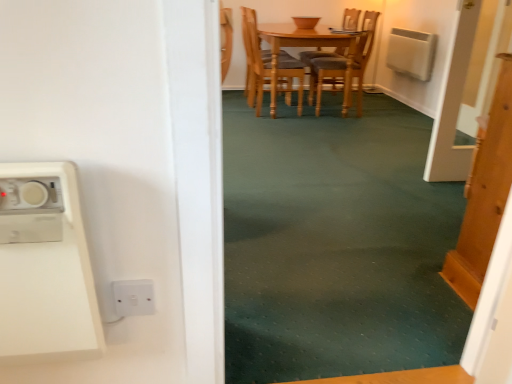
Question: Considering the relative sizes of wooden door at right and light brown wooden chair at center in the image provided, is wooden door at right shorter than light brown wooden chair at center?

Choices:
 (A) no
 (B) yes

Answer: (A)

Question: Is wooden door at right taller than light brown wooden chair at center?

Choices:
 (A) yes
 (B) no

Answer: (A)

Question: From a real-world perspective, is wooden door at right under light brown wooden chair at center?

Choices:
 (A) yes
 (B) no

Answer: (A)

Question: Does wooden door at right come behind light brown wooden chair at center?

Choices:
 (A) yes
 (B) no

Answer: (B)

Question: Considering the relative sizes of wooden door at right and light brown wooden chair at center in the image provided, is wooden door at right wider than light brown wooden chair at center?

Choices:
 (A) yes
 (B) no

Answer: (B)

Question: Is light brown wooden chair at center completely or partially inside wooden door at right?

Choices:
 (A) yes
 (B) no

Answer: (B)

Question: Is light brown wooden chair at center bigger than wooden door at right?

Choices:
 (A) no
 (B) yes

Answer: (B)

Question: Considering the relative sizes of light brown wooden chair at center and wooden door at right in the image provided, is light brown wooden chair at center thinner than wooden door at right?

Choices:
 (A) yes
 (B) no

Answer: (B)

Question: Can you confirm if light brown wooden chair at center is taller than wooden door at right?

Choices:
 (A) no
 (B) yes

Answer: (A)

Question: Is light brown wooden chair at center at the left side of wooden door at right?

Choices:
 (A) no
 (B) yes

Answer: (B)

Question: Is light brown wooden chair at center shorter than wooden door at right?

Choices:
 (A) yes
 (B) no

Answer: (A)

Question: Does light brown wooden chair at center have a smaller size compared to wooden door at right?

Choices:
 (A) yes
 (B) no

Answer: (B)

Question: Does white plastic microwave at left appear on the left side of green carpet at center?

Choices:
 (A) yes
 (B) no

Answer: (A)